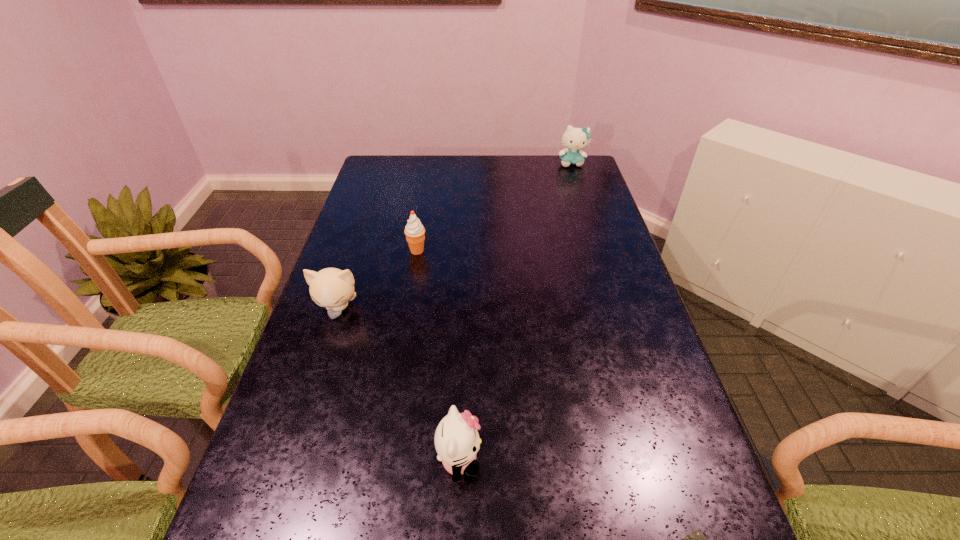
This screenshot has height=540, width=960. Find the location of `the rightmost kitten`. the rightmost kitten is located at coordinates [574, 139].

In order to click on the farthest kitten in this screenshot , I will do `click(574, 139)`.

I want to click on the second object from left to right, so click(x=415, y=232).

I want to click on icecream, so click(415, 232).

The image size is (960, 540). Identify the location of the second nearest kitten. (332, 288).

The height and width of the screenshot is (540, 960). I want to click on the third nearest object, so click(x=332, y=288).

Identify the location of the second nearest object. This screenshot has width=960, height=540. 457,441.

Where is `the second kitten from left to right`? This screenshot has height=540, width=960. the second kitten from left to right is located at coordinates (457, 441).

The width and height of the screenshot is (960, 540). I want to click on vacant space located 0.110m on the face of the farthest object, so pyautogui.click(x=578, y=183).

Image resolution: width=960 pixels, height=540 pixels. I want to click on vacant space located on the front of the fourth nearest object, so click(400, 348).